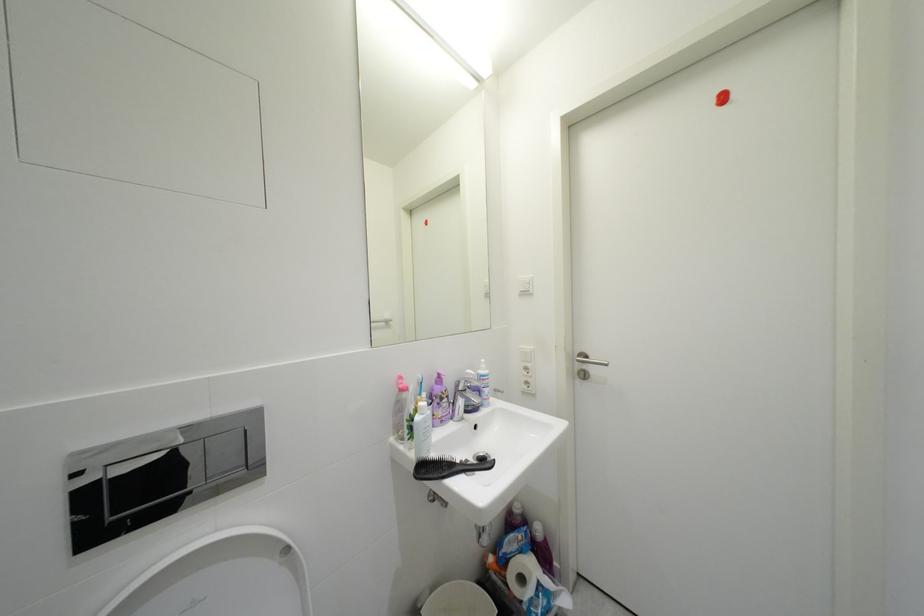
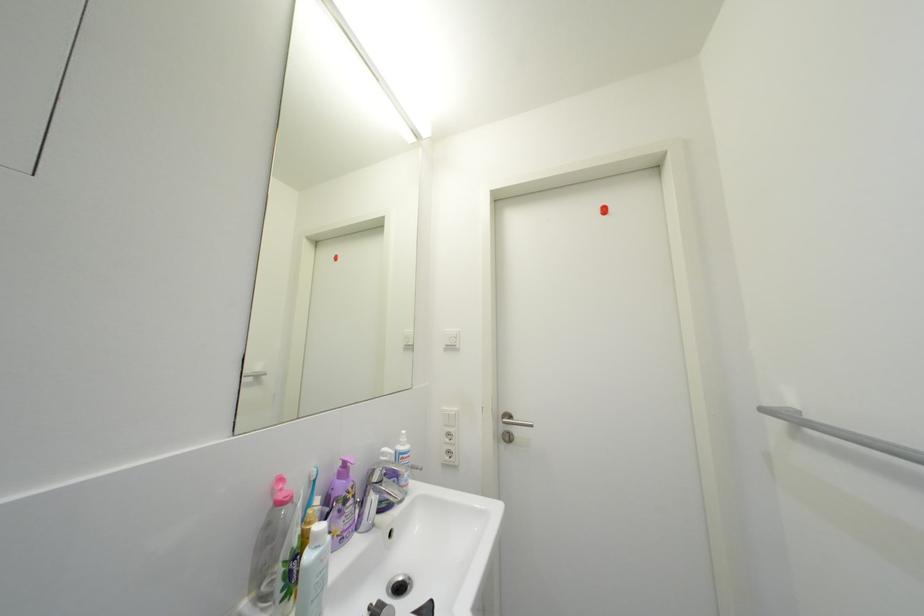
Question: The camera is either moving clockwise (left) or counter-clockwise (right) around the object. The first image is from the beginning of the video and the second image is from the end. Is the camera moving left or right when shooting the video?

Choices:
 (A) Left
 (B) Right

Answer: (A)